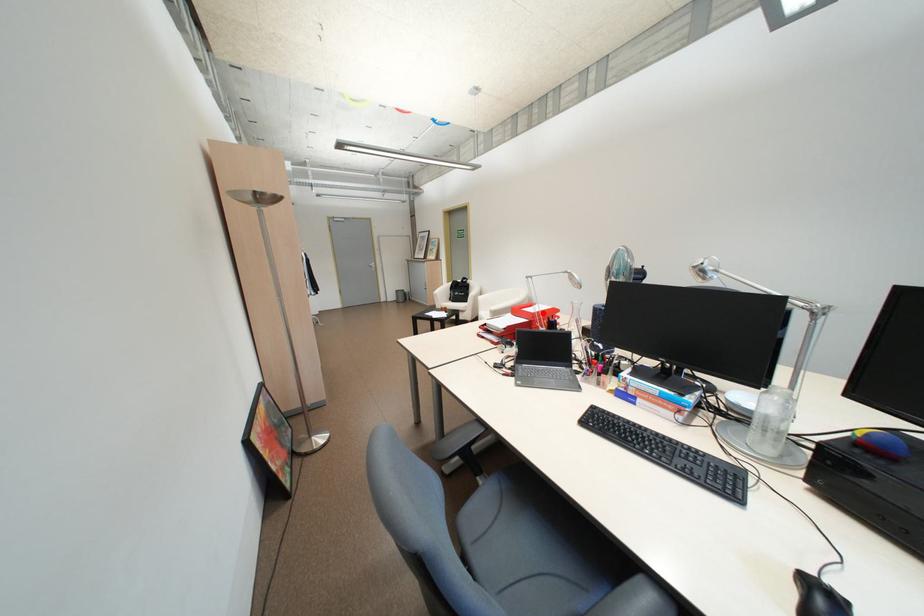
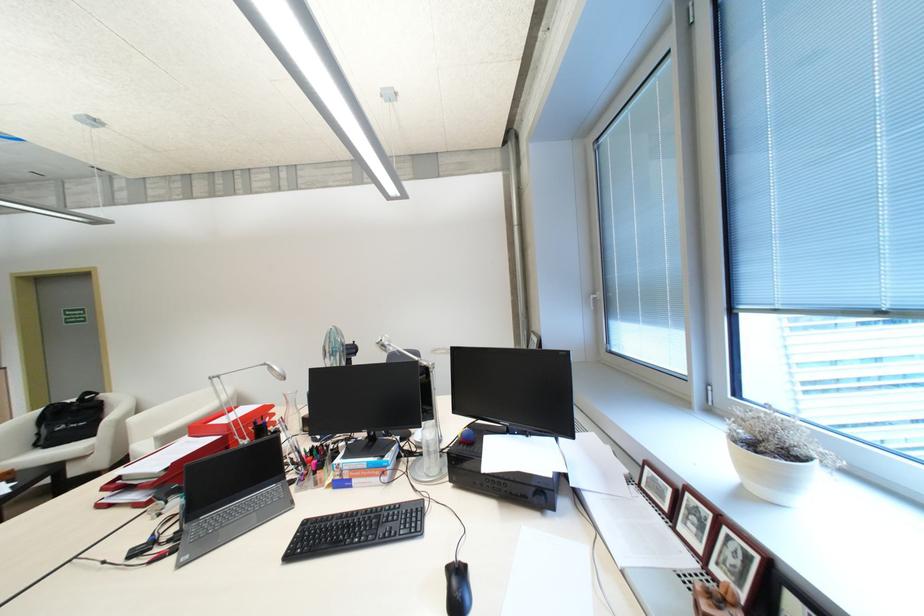
The point at the highlighted location is marked in the first image. Where is the corresponding point in the second image?

(237, 424)